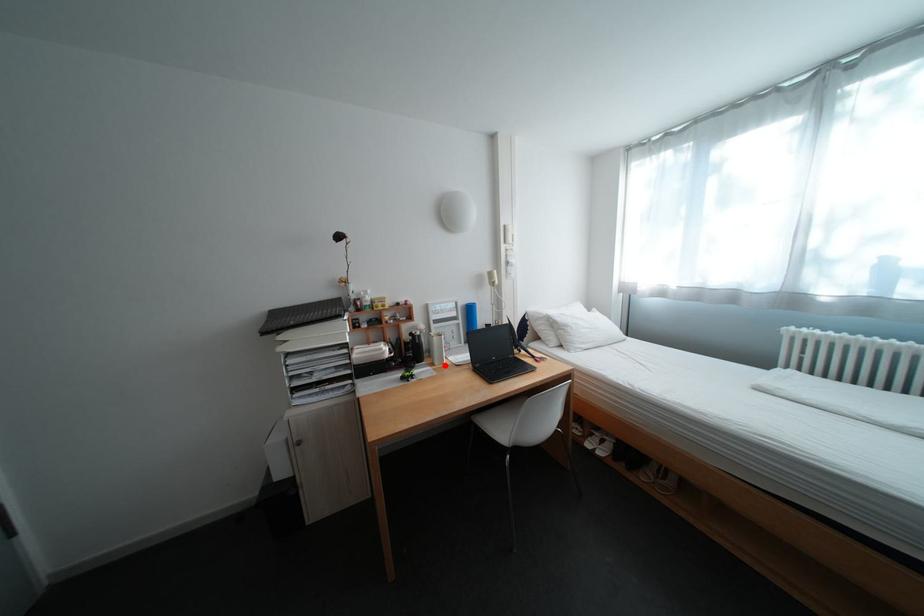
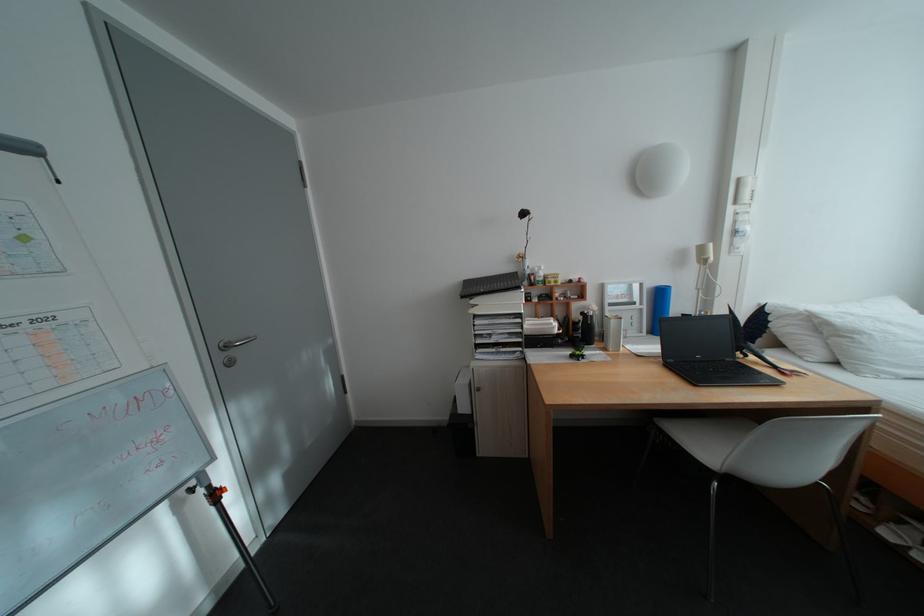
Locate, in the second image, the point that corresponds to the highlighted location in the first image.

(617, 350)